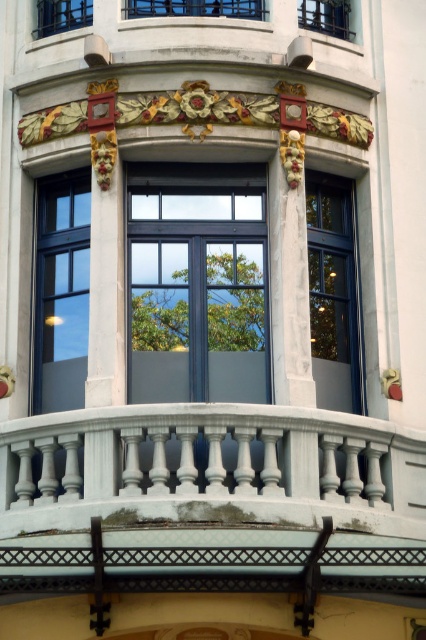
In the scene shown: You are a window installer standing on the balcony below the clear glass window at upper center. You need to reach the window to clean it. The safety harness you have can extend up to 60 meters. Is your harness long enough to reach the window?

The clear glass window at upper center is 68.19 meters away from the balcony. Since the safety harness can only extend up to 60 meters, it is not long enough to reach the window safely.

You are an architect designing a new building and want to ensure that the white stone balustrade at center and the matte black window at upper left are proportionate. Based on the image, which object is larger in size?

The white stone balustrade at center is larger in size compared to the matte black window at upper left according to the description.